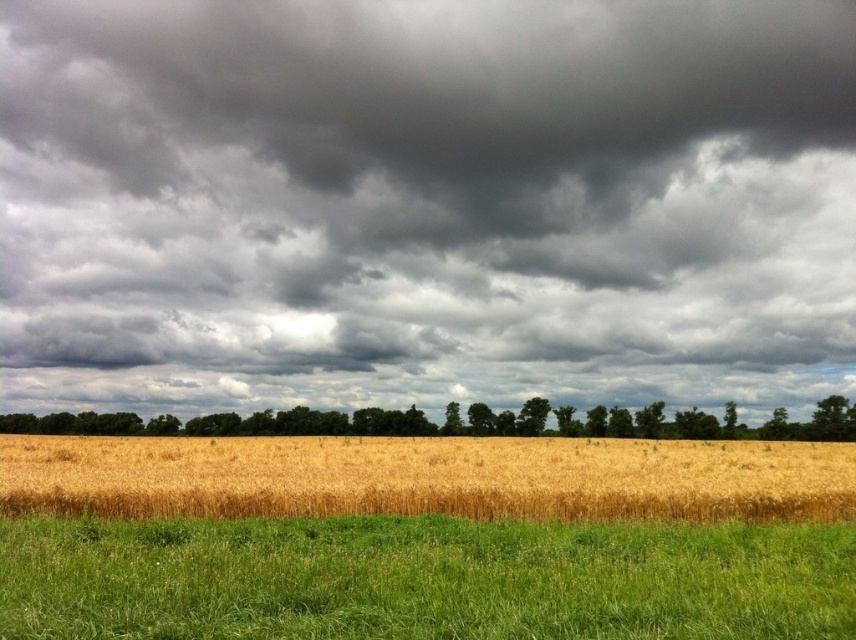
Question: Does dark gray cloud at upper center have a larger size compared to golden wheat field at center?

Choices:
 (A) no
 (B) yes

Answer: (B)

Question: Which object is positioned farthest from the dark gray cloud at upper center?

Choices:
 (A) green grassy field at lower center
 (B) green leafy trees at center

Answer: (A)

Question: Does golden wheat field at center appear under green leafy trees at center?

Choices:
 (A) yes
 (B) no

Answer: (B)

Question: Which object is the farthest from the green grassy field at lower center?

Choices:
 (A) golden wheat field at center
 (B) dark gray cloud at upper center
 (C) green leafy trees at center

Answer: (B)

Question: Considering the real-world distances, which object is farthest from the dark gray cloud at upper center?

Choices:
 (A) green leafy trees at center
 (B) golden wheat field at center

Answer: (B)

Question: Can you confirm if golden wheat field at center is positioned to the right of green leafy trees at center?

Choices:
 (A) no
 (B) yes

Answer: (A)